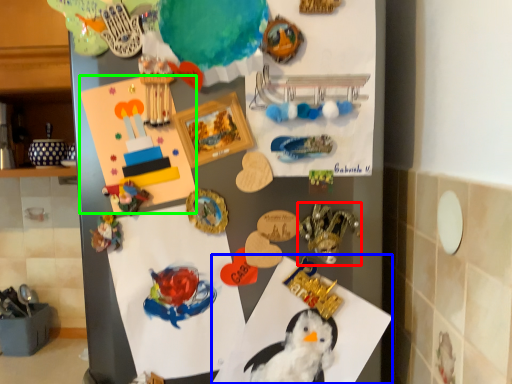
Question: Which object is the closest to the toy (highlighted by a red box)? Choose among these: paper (highlighted by a blue box) or postcard (highlighted by a green box).

Choices:
 (A) paper
 (B) postcard

Answer: (A)